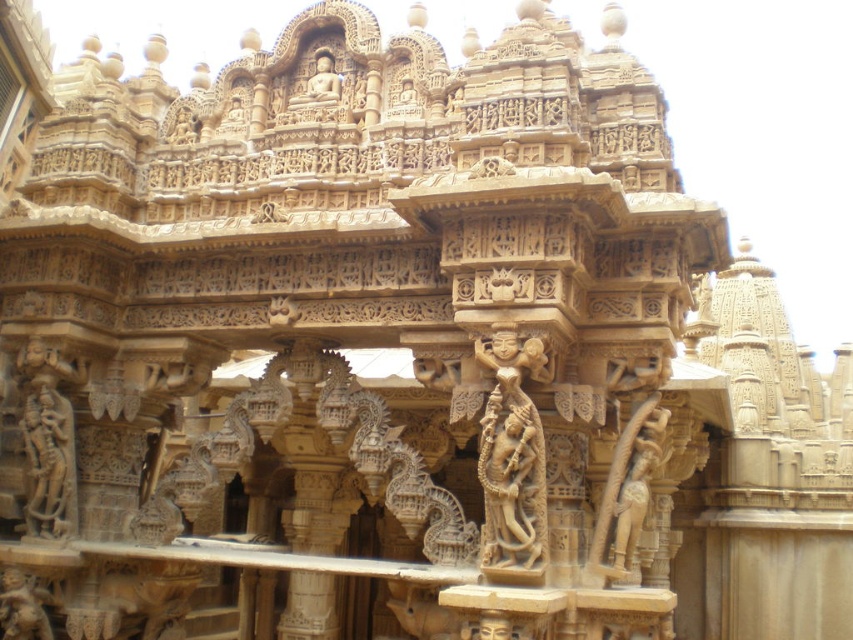
Which is behind, point (68, 412) or point (653, 442)?

Point (68, 412)

You are a GUI agent. You are given a task and a screenshot of the screen. Output one action in this format:
    pyautogui.click(x=<x>, y=<y>)
    Task: Click on the beige stone statue at left
    This screenshot has height=640, width=853.
    Given the screenshot: What is the action you would take?
    pyautogui.click(x=48, y=444)

Based on the photo, does carved beige statue at center have a smaller size compared to golden sandstone statue at center?

Incorrect, carved beige statue at center is not smaller in size than golden sandstone statue at center.

Which of these two, carved beige statue at center or golden sandstone statue at center, stands taller?

carved beige statue at center is taller.

Is point (637, 520) positioned after point (335, 81)?

No, it is not.

I want to click on carved beige statue at center, so click(x=627, y=492).

Measure the distance from beige stone statue at left to golden sandstone statue at lower left.

The distance of beige stone statue at left from golden sandstone statue at lower left is 5.59 meters.

Between point (28, 470) and point (19, 609), which one is positioned in front?

Point (19, 609) is more forward.

Is point (22, 412) closer to viewer compared to point (6, 630)?

That is False.

The image size is (853, 640). Identify the location of beige stone statue at left. (48, 444).